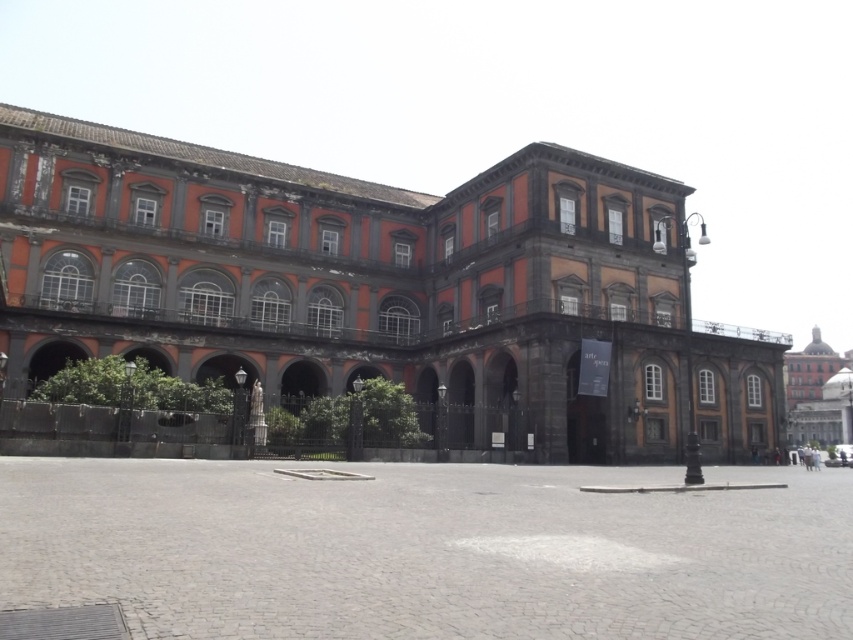
Question: Is red brick building at center to the left of dark gray stone building at center from the viewer's perspective?

Choices:
 (A) no
 (B) yes

Answer: (B)

Question: Among these objects, which one is nearest to the camera?

Choices:
 (A) red brick building at center
 (B) dark gray stone building at center

Answer: (A)

Question: Is red brick building at center positioned before dark gray stone building at center?

Choices:
 (A) yes
 (B) no

Answer: (A)

Question: Can you confirm if red brick building at center is bigger than dark gray stone building at center?

Choices:
 (A) yes
 (B) no

Answer: (A)

Question: Which of the following is the farthest from the observer?

Choices:
 (A) (28, 140)
 (B) (788, 371)

Answer: (B)

Question: Which object appears closest to the camera in this image?

Choices:
 (A) red brick building at center
 (B) dark gray stone building at center

Answer: (A)